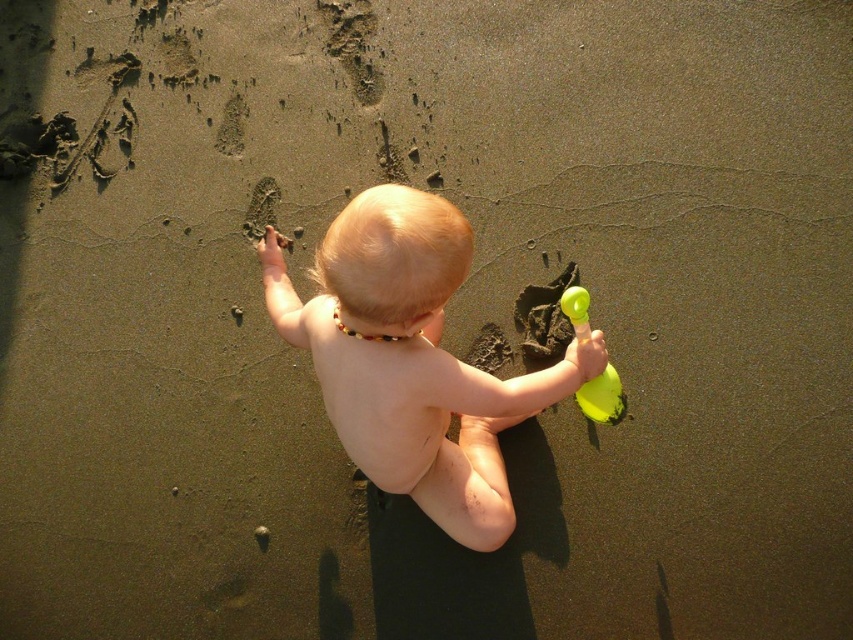
You are a photographer at the beach. You want to take a photo of the smooth skin baby at center and the green rubber toy at right. Which object should you focus on first if you want to capture both in the same frame without moving the camera?

The smooth skin baby at center is bigger than the green rubber toy at right, so you should focus on the smooth skin baby at center first to ensure it is in clear view before adjusting for the smaller green rubber toy at right.

You are a photographer trying to capture a photo of the smooth skin baby at center and the green rubber toy at right. Which object should you focus on first if you want to ensure both are in sharp focus?

The smooth skin baby at center is in front of the green rubber toy at right, so you should focus on the smooth skin baby at center first to ensure both are in sharp focus.

You are standing at the beach and want to pick up the yellow toy. The point where you need to step on is at coordinates point (328, 404). If your reach is 1.5 meters, can you reach the toy without moving your feet?

The distance of point (328, 404) from viewer is 1.89 meters, so no, you cannot reach the toy without moving your feet since it is further away than your reach of 1.5 meters.